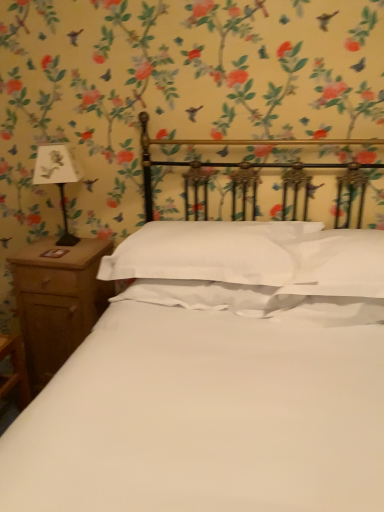
Question: Is brown wood nightstand at left with white paper at left?

Choices:
 (A) no
 (B) yes

Answer: (A)

Question: Can you confirm if brown wood nightstand at left is shorter than white paper at left?

Choices:
 (A) yes
 (B) no

Answer: (B)

Question: Considering the relative sizes of brown wood nightstand at left and white paper at left in the image provided, is brown wood nightstand at left smaller than white paper at left?

Choices:
 (A) no
 (B) yes

Answer: (A)

Question: Is brown wood nightstand at left oriented towards white paper at left?

Choices:
 (A) yes
 (B) no

Answer: (B)

Question: Does brown wood nightstand at left have a larger size compared to white paper at left?

Choices:
 (A) yes
 (B) no

Answer: (A)

Question: Is brown wood nightstand at left positioned far away from white paper at left?

Choices:
 (A) no
 (B) yes

Answer: (A)

Question: Is brown wood nightstand at left inside white smooth pillow at center?

Choices:
 (A) yes
 (B) no

Answer: (B)

Question: From a real-world perspective, is white smooth pillow at center on brown wood nightstand at left?

Choices:
 (A) yes
 (B) no

Answer: (A)

Question: Does white smooth pillow at center appear on the right side of brown wood nightstand at left?

Choices:
 (A) yes
 (B) no

Answer: (A)

Question: From a real-world perspective, is white smooth pillow at center positioned under brown wood nightstand at left based on gravity?

Choices:
 (A) no
 (B) yes

Answer: (A)

Question: Is white smooth pillow at center to the left of brown wood nightstand at left from the viewer's perspective?

Choices:
 (A) no
 (B) yes

Answer: (A)

Question: Does white smooth pillow at center have a greater height compared to brown wood nightstand at left?

Choices:
 (A) yes
 (B) no

Answer: (B)

Question: From a real-world perspective, is white paper at left beneath brown wood nightstand at left?

Choices:
 (A) no
 (B) yes

Answer: (A)